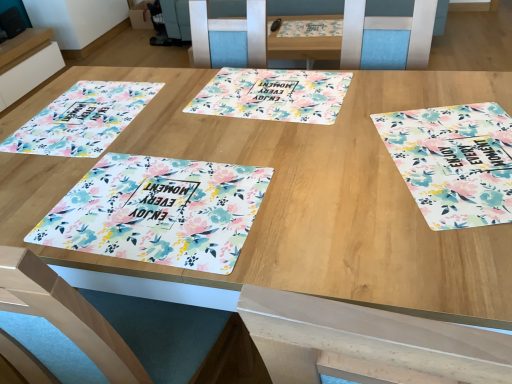
Locate an element on the screen. This screenshot has width=512, height=384. empty space that is to the right of floral printed placemat at left, acting as the 1th tablecloth starting from the left is located at coordinates (199, 107).